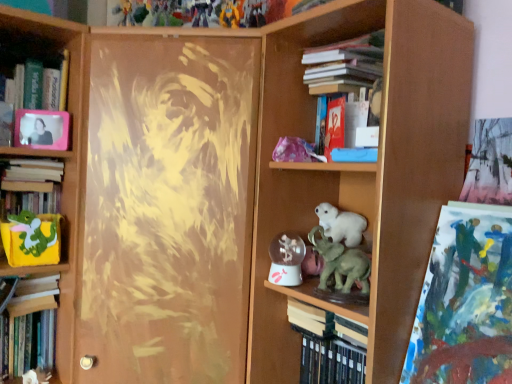
This screenshot has width=512, height=384. What are the coordinates of `pink plastic picture frame at upper left` in the screenshot? It's located at (42, 129).

What is the approximate width of wooden bookcase at center?

wooden bookcase at center is 14.94 inches in width.

Describe the element at coordinates (362, 170) in the screenshot. The width and height of the screenshot is (512, 384). I see `wooden bookcase at center` at that location.

What do you see at coordinates (325, 348) in the screenshot?
I see `black matte book at center, acting as the 1th book starting from the bottom` at bounding box center [325, 348].

Where is `black matte book at center, which is counted as the second book, starting from the right`? black matte book at center, which is counted as the second book, starting from the right is located at coordinates (325, 348).

What is the approximate height of matte green plush toy at left, acting as the 1th animal starting from the back?

matte green plush toy at left, acting as the 1th animal starting from the back, is 15.78 centimeters in height.

At what (x,y) coordinates should I click in order to perform the action: click on hardcover book at upper right, the 5th book viewed from the left. Please return your answer as a coordinate pair (x, y). This screenshot has height=384, width=512. Looking at the image, I should click on (345, 63).

What do you see at coordinates (345, 63) in the screenshot?
I see `hardcover book at upper right, the 5th book viewed from the left` at bounding box center [345, 63].

In order to face red matte book at upper center, the second paperback book when ordered from back to front, should I rotate leftwards or rightwards?

You should look right and rotate roughly 10.891 degrees.

This screenshot has height=384, width=512. What do you see at coordinates (334, 126) in the screenshot?
I see `red matte book at upper center, which is the first paperback book from top to bottom` at bounding box center [334, 126].

This screenshot has height=384, width=512. Identify the location of pink plastic picture frame at upper left. (42, 129).

Considering the sizes of objects hardcover book at center, which ranks as the first paperback book in bottom-to-top order, and abstract acrylic painting at upper right in the image provided, who is bigger, hardcover book at center, which ranks as the first paperback book in bottom-to-top order, or abstract acrylic painting at upper right?

abstract acrylic painting at upper right.

In the image, is hardcover book at center, which ranks as the first paperback book in bottom-to-top order, on the left side or the right side of abstract acrylic painting at upper right?

hardcover book at center, which ranks as the first paperback book in bottom-to-top order, is to the left of abstract acrylic painting at upper right.

Can we say hardcover book at center, acting as the first paperback book starting from the back, lies outside abstract acrylic painting at upper right?

Indeed, hardcover book at center, acting as the first paperback book starting from the back, is completely outside abstract acrylic painting at upper right.

Which is less distant, (292, 313) or (509, 263)?

Point (292, 313) is positioned farther from the camera compared to point (509, 263).

Between hardcover book at left, the third book from the top, and matte green plush toy at left, acting as the 2th animal starting from the right, which one is positioned in front?

matte green plush toy at left, acting as the 2th animal starting from the right, is closer to the camera.

Is hardcover book at left, the third book from the top, looking in the opposite direction of matte green plush toy at left, positioned as the 1th animal in left-to-right order?

No.

Which of these two, hardcover book at left, the third book from the top, or matte green plush toy at left, which is the 2th animal from front to back, stands shorter?

Standing shorter between the two is hardcover book at left, the third book from the top.

In the scene shown: From a real-world perspective, is hardcover book at left, which is the 2th book in left-to-right order, located beneath matte green plush toy at left, acting as the 2th animal starting from the right?

Actually, hardcover book at left, which is the 2th book in left-to-right order, is physically above matte green plush toy at left, acting as the 2th animal starting from the right, in the real world.

Which object is further away from the camera taking this photo, wooden bookcase at center or hardcover book at left, the fifth book from the right?

hardcover book at left, the fifth book from the right, is further from the camera.

From a real-world perspective, which is physically below, wooden bookcase at center or hardcover book at left, the fifth book from the right?

hardcover book at left, the fifth book from the right.

Find the location of `bookcase above the hardcover book at left, which is counted as the 4th book, starting from the top (from a real-world perspective)`. bookcase above the hardcover book at left, which is counted as the 4th book, starting from the top (from a real-world perspective) is located at coordinates (362, 170).

Is wooden bookcase at center smaller than hardcover book at left, the first book in the left-to-right sequence?

No, wooden bookcase at center is not smaller than hardcover book at left, the first book in the left-to-right sequence.

Between wooden bookcase at center and hardcover book at left, which is the 2th book in left-to-right order, which one has larger size?

wooden bookcase at center.

From a real-world perspective, is wooden bookcase at center located beneath hardcover book at left, which is the third book from bottom to top?

Yes, from a real-world perspective, wooden bookcase at center is beneath hardcover book at left, which is the third book from bottom to top.

Is point (309, 26) closer to camera compared to point (62, 165)?

That is True.

From the picture: How many degrees apart are the facing directions of wooden bookcase at center and hardcover book at left, which is the 2th book in left-to-right order?

There is a 88.6-degree angle between the facing directions of wooden bookcase at center and hardcover book at left, which is the 2th book in left-to-right order.

Based on the photo, is hardcover book at upper right, the 1th book viewed from the top, positioned before abstract acrylic painting at upper right?

No, hardcover book at upper right, the 1th book viewed from the top, is further to the viewer.

Between hardcover book at upper right, the 5th book viewed from the left, and abstract acrylic painting at upper right, which one has smaller size?

With smaller size is hardcover book at upper right, the 5th book viewed from the left.

Which of these two, hardcover book at upper right, which ranks as the fifth book in bottom-to-top order, or abstract acrylic painting at upper right, stands taller?

abstract acrylic painting at upper right.

Between pink plastic picture frame at upper left and hardcover book at left, the third book from the top, which one has smaller size?

With smaller size is pink plastic picture frame at upper left.

Is pink plastic picture frame at upper left closer to camera compared to hardcover book at left, which is the third book from bottom to top?

No, pink plastic picture frame at upper left is further to the viewer.

Is pink plastic picture frame at upper left completely or partially outside of hardcover book at left, positioned as the fourth book in right-to-left order?

pink plastic picture frame at upper left is positioned outside hardcover book at left, positioned as the fourth book in right-to-left order.

Between black matte book at center, placed as the fourth book when sorted from left to right, and hardcover book at left, acting as the second book starting from the bottom, which one appears on the right side from the viewer's perspective?

Positioned to the right is black matte book at center, placed as the fourth book when sorted from left to right.

Which is in front, point (350, 382) or point (23, 338)?

Point (350, 382)

From a real-world perspective, is black matte book at center, which is the fifth book from top to bottom, on hardcover book at left, which is counted as the 4th book, starting from the top?

Indeed, from a real-world perspective, black matte book at center, which is the fifth book from top to bottom, stands above hardcover book at left, which is counted as the 4th book, starting from the top.

Is black matte book at center, which is counted as the second book, starting from the right, far away from hardcover book at left, which is counted as the 4th book, starting from the top?

black matte book at center, which is counted as the second book, starting from the right, is near hardcover book at left, which is counted as the 4th book, starting from the top, not far away.

Identify the location of paperback book that appears below the abstract acrylic painting at upper right (from the image's perspective). The height and width of the screenshot is (384, 512). (310, 318).

What are the coordinates of `book that is the 2nd one when counting backward from the matte green plush toy at left, acting as the 2th animal starting from the right` in the screenshot? It's located at (34, 170).

From the image, which object appears to be farther from hardcover book at left, which is the third book from bottom to top, red matte book at upper center, which is the first paperback book from top to bottom, or matte green plush toy at left, which is the 2th animal from front to back?

red matte book at upper center, which is the first paperback book from top to bottom, is further to hardcover book at left, which is the third book from bottom to top.

Looking at the image, which one is located further to pink plastic picture frame at upper left, hardcover book at left, the third book from the top, or wooden bookcase at center?

wooden bookcase at center lies further to pink plastic picture frame at upper left than the other object.

From the image, which object appears to be nearer to hardcover book at left, which is counted as the 4th book, starting from the top, hardcover book at left, positioned as the fourth book in right-to-left order, or matte green plush toy at left, acting as the 1th animal starting from the back?

The object closer to hardcover book at left, which is counted as the 4th book, starting from the top, is matte green plush toy at left, acting as the 1th animal starting from the back.

Which object lies nearer to the anchor point pink plastic frame at upper left, acting as the third book starting from the left, matte green plush toy at left, acting as the 1th animal starting from the back, or abstract acrylic painting at upper right?

matte green plush toy at left, acting as the 1th animal starting from the back, is positioned closer to the anchor pink plastic frame at upper left, acting as the third book starting from the left.

Based on their spatial positions, is matte green plush toy at left, positioned as the 1th animal in left-to-right order, or pink plastic picture frame at upper left further from abstract acrylic painting at upper right?

Among the two, pink plastic picture frame at upper left is located further to abstract acrylic painting at upper right.

Considering their positions, is hardcover book at center, which ranks as the first paperback book in bottom-to-top order, positioned further to pink plastic picture frame at upper left than hardcover book at left, which is the third book from bottom to top?

hardcover book at center, which ranks as the first paperback book in bottom-to-top order, lies further to pink plastic picture frame at upper left than the other object.

Estimate the real-world distances between objects in this image. Which object is further from wooden bookcase at center, hardcover book at left, which is the third book from bottom to top, or abstract acrylic painting at upper right?

hardcover book at left, which is the third book from bottom to top, is further to wooden bookcase at center.

Looking at the image, which one is located further to wooden bookcase at center, black matte book at center, acting as the 1th book starting from the bottom, or red matte book at upper center, the 1th paperback book when ordered from front to back?

black matte book at center, acting as the 1th book starting from the bottom, is positioned further to the anchor wooden bookcase at center.

You are a GUI agent. You are given a task and a screenshot of the screen. Output one action in this format:
    pyautogui.click(x=<x>, y=<y>)
    Task: Click on the book situated between pink plastic frame at upper left, the fourth book when ordered from bottom to top, and hardcover book at upper right, the first book in the right-to-left sequence, from left to right
    
    Given the screenshot: What is the action you would take?
    pyautogui.click(x=325, y=348)

You are a GUI agent. You are given a task and a screenshot of the screen. Output one action in this format:
    pyautogui.click(x=<x>, y=<y>)
    Task: Click on the picture frame between matte green plush toy at left, acting as the 2th animal starting from the right, and hardcover book at upper right, the first book in the right-to-left sequence, in the horizontal direction
    The height and width of the screenshot is (384, 512).
    Given the screenshot: What is the action you would take?
    pyautogui.click(x=42, y=129)

Identify the location of picture frame between hardcover book at left, positioned as the fourth book in right-to-left order, and hardcover book at center, acting as the first paperback book starting from the back. This screenshot has width=512, height=384. (42, 129).

Locate an element on the screen. This screenshot has width=512, height=384. bookcase located between hardcover book at left, acting as the second book starting from the bottom, and hardcover book at upper right, which ranks as the fifth book in bottom-to-top order, in the left-right direction is located at coordinates (362, 170).